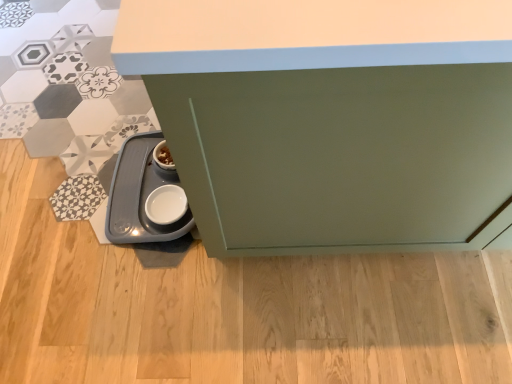
At what (x,y) coordinates should I click in order to perform the action: click on unoccupied area in front of white glossy pet feeder at lower left. Please return your answer as a coordinate pair (x, y). The width and height of the screenshot is (512, 384). Looking at the image, I should click on (150, 317).